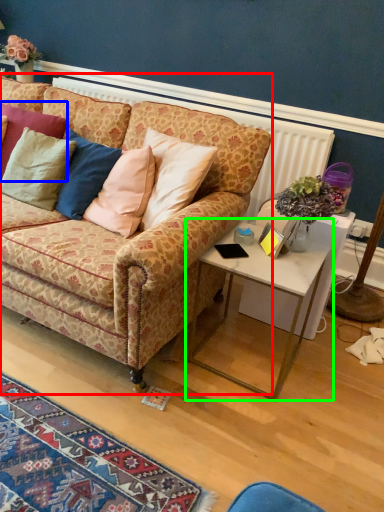
Question: Which is nearer to the studio couch (highlighted by a red box)? pillow (highlighted by a blue box) or table (highlighted by a green box).

Choices:
 (A) pillow
 (B) table

Answer: (B)